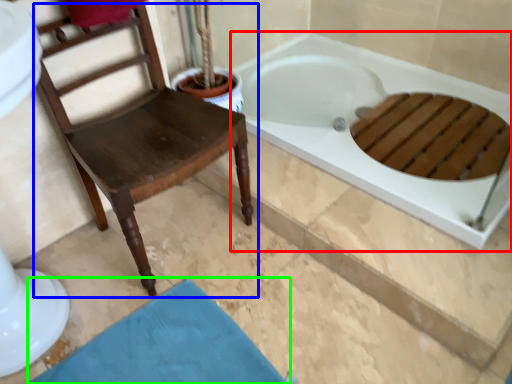
Question: Based on their relative distances, which object is nearer to bathtub (highlighted by a red box)? Choose from chair (highlighted by a blue box) and bath mat (highlighted by a green box).

Choices:
 (A) chair
 (B) bath mat

Answer: (A)